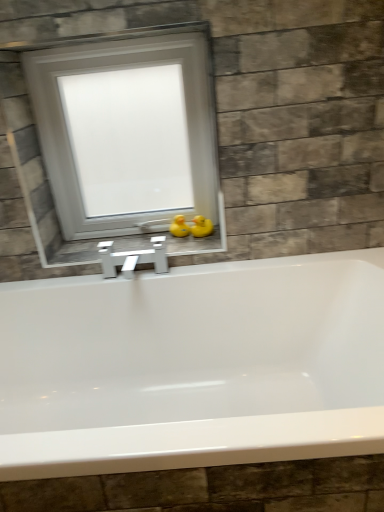
Question: Is yellow rubber duck at center, the first duck when ordered from right to left, next to white frosted glass window at upper center?

Choices:
 (A) yes
 (B) no

Answer: (B)

Question: From the image's perspective, is yellow rubber duck at center, the second duck from the left, beneath white frosted glass window at upper center?

Choices:
 (A) no
 (B) yes

Answer: (B)

Question: Does yellow rubber duck at center, the second duck from the left, appear on the left side of white frosted glass window at upper center?

Choices:
 (A) yes
 (B) no

Answer: (B)

Question: Is yellow rubber duck at center, the first duck when ordered from right to left, thinner than white frosted glass window at upper center?

Choices:
 (A) yes
 (B) no

Answer: (A)

Question: Is yellow rubber duck at center, the second duck from the left, aimed at white frosted glass window at upper center?

Choices:
 (A) yes
 (B) no

Answer: (B)

Question: Considering the positions of white frosted glass window at upper center and white glossy window sill at center in the image, is white frosted glass window at upper center wider or thinner than white glossy window sill at center?

Choices:
 (A) wide
 (B) thin

Answer: (B)

Question: Visually, is white frosted glass window at upper center positioned to the left or to the right of white glossy window sill at center?

Choices:
 (A) right
 (B) left

Answer: (B)

Question: Considering the positions of white frosted glass window at upper center and white glossy window sill at center in the image, is white frosted glass window at upper center taller or shorter than white glossy window sill at center?

Choices:
 (A) short
 (B) tall

Answer: (B)

Question: Is white frosted glass window at upper center bigger or smaller than white glossy window sill at center?

Choices:
 (A) small
 (B) big

Answer: (B)

Question: From a real-world perspective, is yellow rubber duck at center, the first duck when ordered from right to left, positioned above or below yellow rubber duck at center, which is the first duck from left to right?

Choices:
 (A) above
 (B) below

Answer: (A)

Question: Choose the correct answer: Is yellow rubber duck at center, the first duck when ordered from right to left, inside yellow rubber duck at center, the second duck viewed from the right, or outside it?

Choices:
 (A) outside
 (B) inside

Answer: (A)

Question: In the image, is yellow rubber duck at center, the second duck from the left, positioned in front of or behind yellow rubber duck at center, which is the first duck from left to right?

Choices:
 (A) front
 (B) behind

Answer: (A)

Question: From their relative heights in the image, would you say yellow rubber duck at center, the second duck from the left, is taller or shorter than yellow rubber duck at center, which is the first duck from left to right?

Choices:
 (A) short
 (B) tall

Answer: (A)

Question: Is point (187, 209) closer or farther from the camera than point (173, 230)?

Choices:
 (A) closer
 (B) farther

Answer: (B)

Question: From a real-world perspective, is white frosted glass window at upper center positioned above or below yellow rubber duck at center, the second duck viewed from the right?

Choices:
 (A) below
 (B) above

Answer: (B)